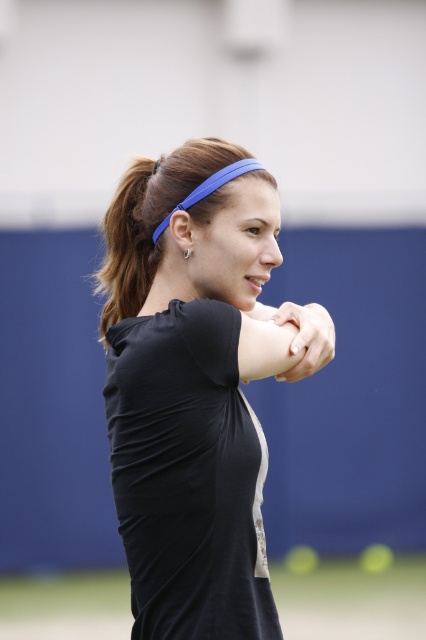
Question: Estimate the real-world distances between objects in this image. Which object is closer to the brown hair at upper left?

Choices:
 (A) black matte headband at center
 (B) smooth skin at center

Answer: (A)

Question: Which object appears closest to the camera in this image?

Choices:
 (A) smooth skin at center
 (B) brown hair at upper left
 (C) black matte headband at center

Answer: (C)

Question: Where is black matte headband at center located in relation to smooth skin at center in the image?

Choices:
 (A) left
 (B) right

Answer: (A)

Question: Does black matte headband at center come behind smooth skin at center?

Choices:
 (A) no
 (B) yes

Answer: (A)

Question: Considering the relative positions of brown hair at upper left and smooth skin at center in the image provided, where is brown hair at upper left located with respect to smooth skin at center?

Choices:
 (A) right
 (B) left

Answer: (B)

Question: Which is nearer to the black matte headband at center?

Choices:
 (A) brown hair at upper left
 (B) smooth skin at center

Answer: (B)